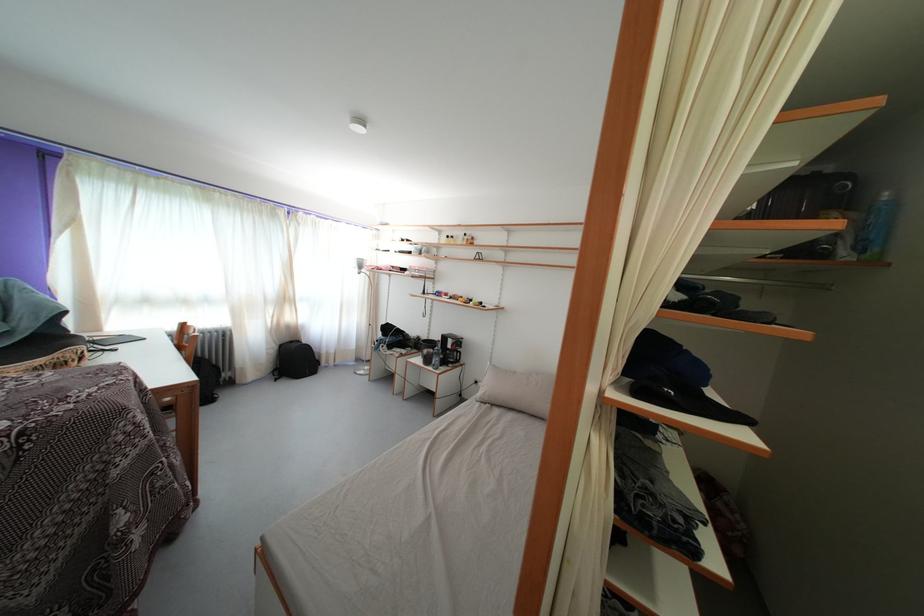
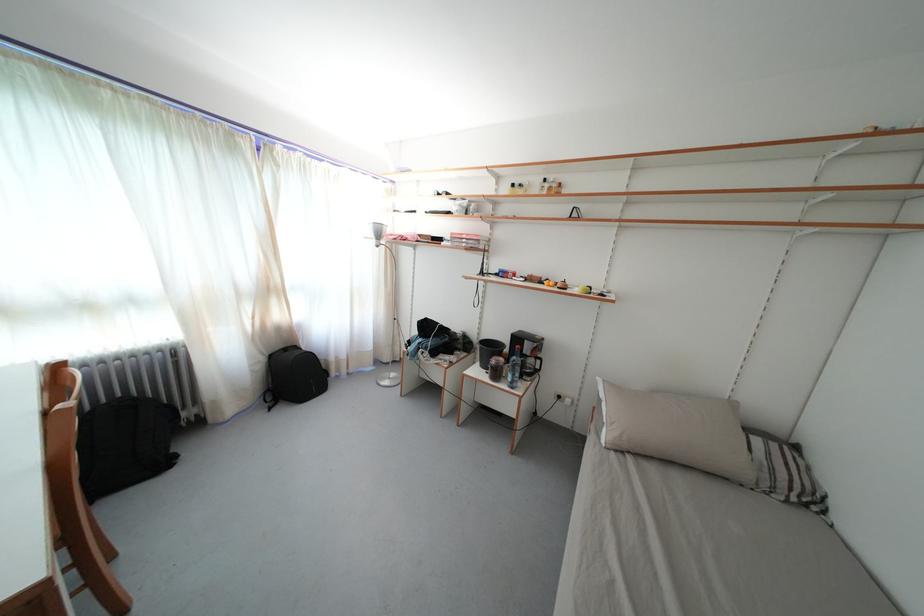
Where in the second image is the point corresponding to (x=361, y=272) from the first image?

(378, 241)